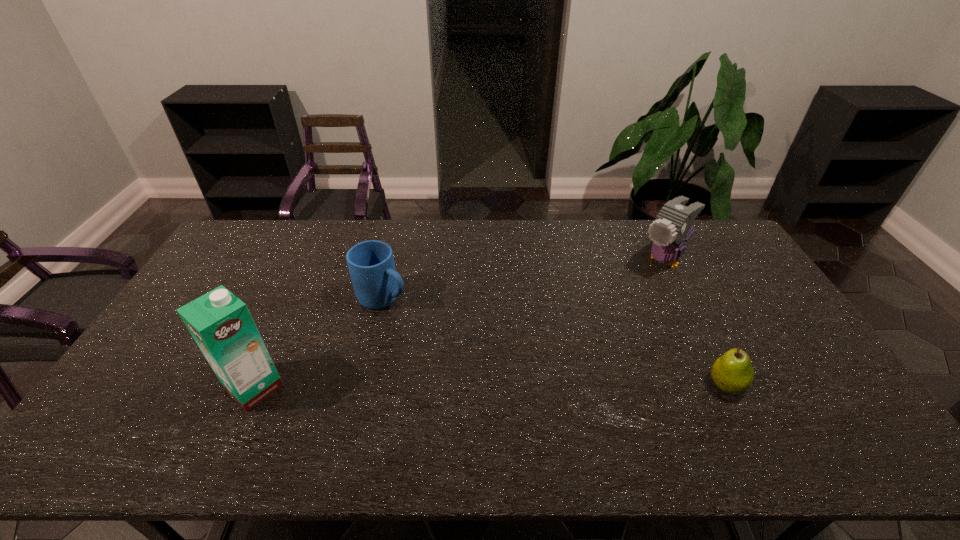
Locate an element on the screen. The height and width of the screenshot is (540, 960). carton is located at coordinates (220, 323).

Image resolution: width=960 pixels, height=540 pixels. In order to click on the tallest object in this screenshot , I will do `click(220, 323)`.

At what (x,y) coordinates should I click in order to perform the action: click on the shortest object. Please return your answer as a coordinate pair (x, y). Looking at the image, I should click on (732, 372).

Find the location of a particular element. the second object from left to right is located at coordinates (376, 284).

Where is `mug`? mug is located at coordinates (376, 284).

Find the location of a particular element. bird is located at coordinates (673, 227).

In order to click on the third shortest object in this screenshot , I will do `click(673, 227)`.

This screenshot has height=540, width=960. I want to click on blank area located 0.240m on the left of the leftmost object, so click(134, 388).

Find the location of `vacant space located on the back of the pear`. vacant space located on the back of the pear is located at coordinates (695, 323).

Locate an element on the screen. free location located on the side of the second shortest object with the handle is located at coordinates (448, 333).